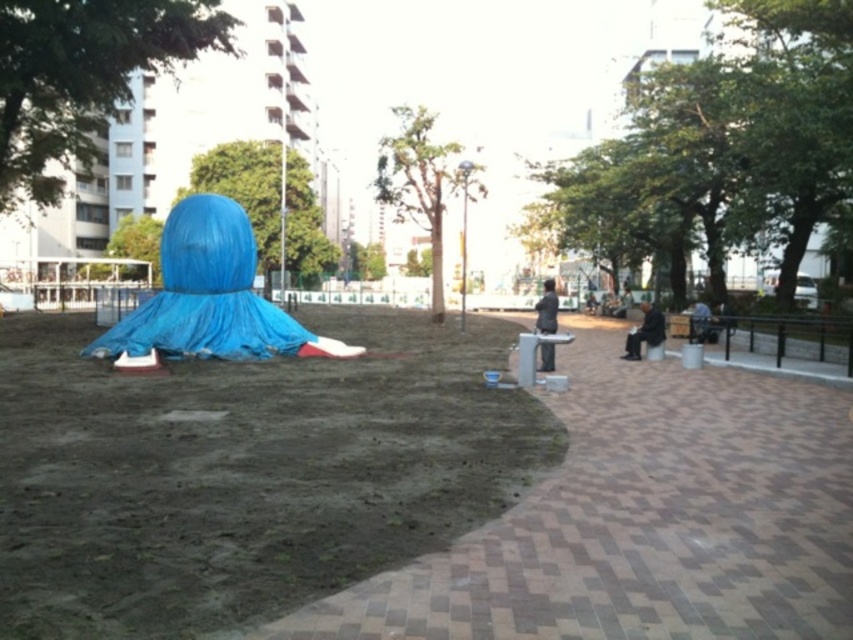
Question: Estimate the real-world distances between objects in this image. Which object is closer to the dark gray fabric bag at right?

Choices:
 (A) dark gray fabric jacket at center-right
 (B) blue tarpaulin sculpture at center
 (C) gray fabric bag at right

Answer: (A)

Question: Estimate the real-world distances between objects in this image. Which object is closer to the gray fabric bag at right?

Choices:
 (A) dirt field at left
 (B) blue tarpaulin sculpture at center
 (C) dark gray fabric bag at right
 (D) dark gray fabric jacket at center-right

Answer: (C)

Question: Considering the relative positions of dirt field at left and gray fabric bag at right in the image provided, where is dirt field at left located with respect to gray fabric bag at right?

Choices:
 (A) right
 (B) left

Answer: (B)

Question: Is blue tarpaulin sculpture at center behind dark gray fabric jacket at center-right?

Choices:
 (A) yes
 (B) no

Answer: (A)

Question: Estimate the real-world distances between objects in this image. Which object is closer to the dirt field at left?

Choices:
 (A) gray fabric bag at right
 (B) blue tarpaulin sculpture at center

Answer: (B)

Question: Does dark gray fabric jacket at center-right have a greater width compared to gray fabric bag at right?

Choices:
 (A) no
 (B) yes

Answer: (B)